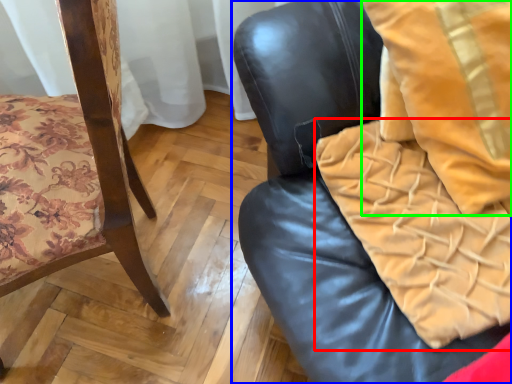
Question: Which object is the closest to the blanket (highlighted by a red box)? Choose among these: chair (highlighted by a blue box) or throw pillow (highlighted by a green box).

Choices:
 (A) chair
 (B) throw pillow

Answer: (A)